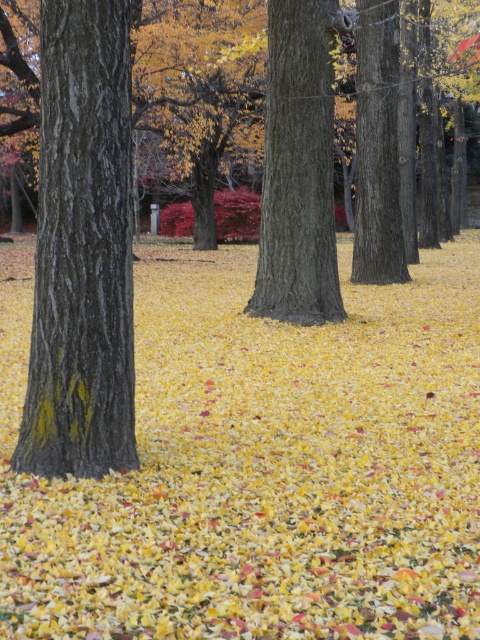
Question: Is smooth bark tree at left smaller than smooth bark tree at center?

Choices:
 (A) no
 (B) yes

Answer: (A)

Question: Estimate the real-world distances between objects in this image. Which object is closer to the smooth bark tree at left?

Choices:
 (A) smooth bark tree at center
 (B) smooth brown tree trunk at center

Answer: (B)

Question: Which is nearer to the smooth bark tree at left?

Choices:
 (A) smooth brown tree trunk at center
 (B) smooth bark tree at center

Answer: (A)

Question: Is smooth bark tree at left above smooth brown tree trunk at center?

Choices:
 (A) no
 (B) yes

Answer: (A)

Question: Estimate the real-world distances between objects in this image. Which object is closer to the smooth bark tree at center?

Choices:
 (A) smooth bark tree at left
 (B) smooth brown tree trunk at center

Answer: (B)

Question: Is smooth bark tree at left below smooth bark tree at center?

Choices:
 (A) no
 (B) yes

Answer: (B)